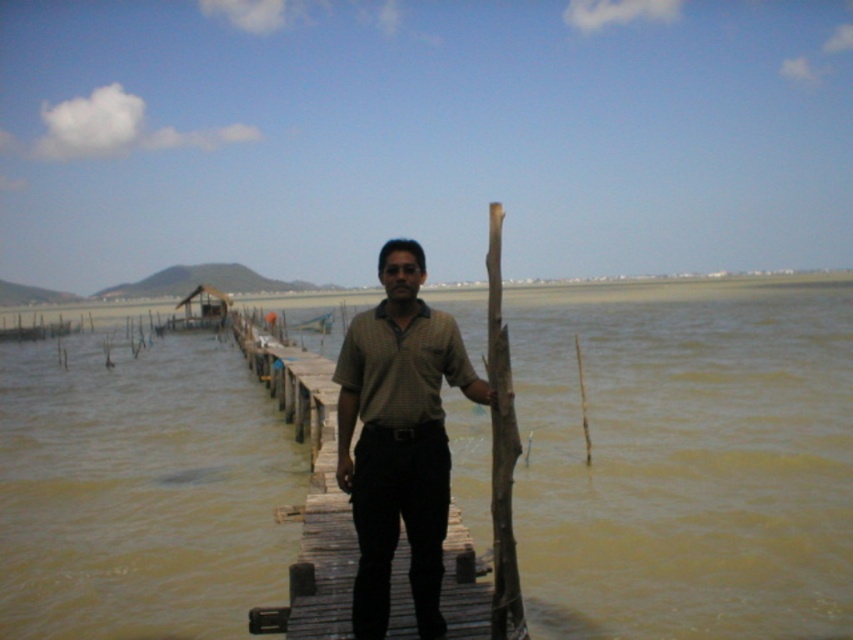
You are a photographer taking a picture of the scene. You notice the brown cotton shirt at center and the brown muddy water at center. Which object is positioned to the right of the other?

The brown muddy water at center is to the right of the brown cotton shirt at center.

You are a photographer trying to capture the man on the pier. You notice the brown muddy water at center and the brown cotton shirt at center. Which one appears larger in height in the photo?

The brown muddy water at center is taller than the brown cotton shirt at center, so it appears larger in height in the photo.

You are standing at the end of the wooden pier and want to reach the two points marked in the image. Which point, point (642, 342) or point (403, 436), is closer to you?

Point (642, 342) is further to the viewer than point (403, 436), so the closer point to you is point (403, 436).